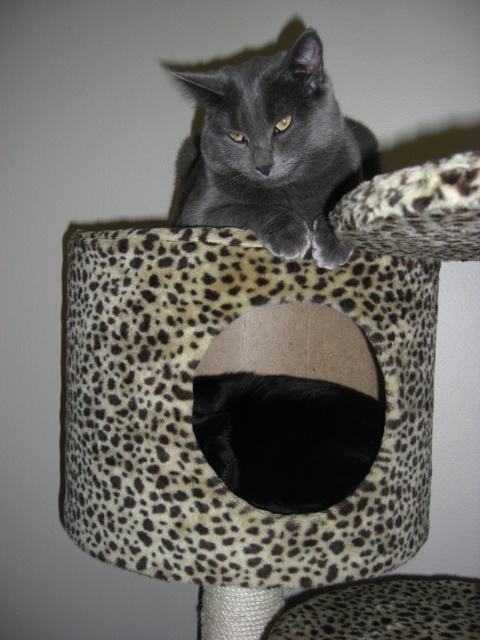
You are a cat lover who wants to place a small toy at the exact location where the matte gray cat at upper center is currently sitting. According to the coordinates provided, where should you place the toy?

The matte gray cat at upper center is located at coordinates point (272, 152), so you should place the toy at that exact point.

You are a cat owner who wants to place a new toy on the leopard print cat bed at center. Considering the current position of the matte gray cat at upper center, where should you place the toy so the cat can easily reach it?

The matte gray cat at upper center is positioned on the left side of the leopard print cat bed at center, so placing the toy on the left side of the leopard print cat bed at center would allow the cat to easily reach it.

You are a cat owner who wants to ensure your cat is comfortable. Looking at the image, which item has a shorter height between the black fur at center and the leopard print cat bed at center?

The black fur at center is shorter than the leopard print cat bed at center.